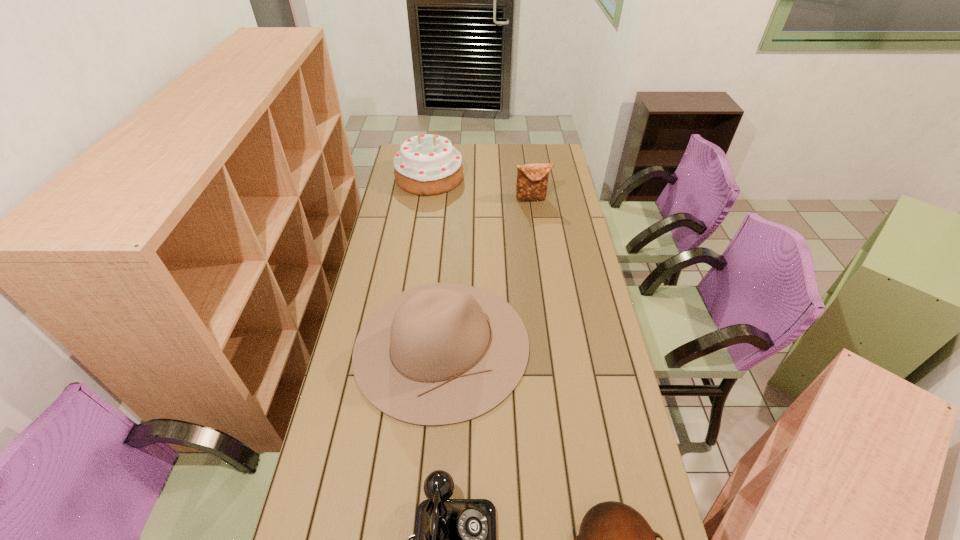
Find the location of `cake`. cake is located at coordinates (427, 164).

Image resolution: width=960 pixels, height=540 pixels. Identify the location of the third farthest object. (459, 351).

Locate an element on the screen. Image resolution: width=960 pixels, height=540 pixels. clutch bag is located at coordinates (532, 179).

This screenshot has height=540, width=960. What are the coordinates of `vacant space located 0.070m on the front of the cake` in the screenshot? It's located at (425, 206).

Where is `vacant space located 0.170m on the back of the third farthest object`? vacant space located 0.170m on the back of the third farthest object is located at coordinates (448, 254).

This screenshot has width=960, height=540. Find the location of `vacant region located on the open side of the third shortest object`. vacant region located on the open side of the third shortest object is located at coordinates (540, 259).

Where is `object that is positioned at the far edge`? Image resolution: width=960 pixels, height=540 pixels. object that is positioned at the far edge is located at coordinates (427, 164).

Where is `cake present at the left edge`? The width and height of the screenshot is (960, 540). cake present at the left edge is located at coordinates (427, 164).

Where is `sombrero situated at the left edge`? sombrero situated at the left edge is located at coordinates (459, 351).

I want to click on object at the right edge, so click(x=532, y=179).